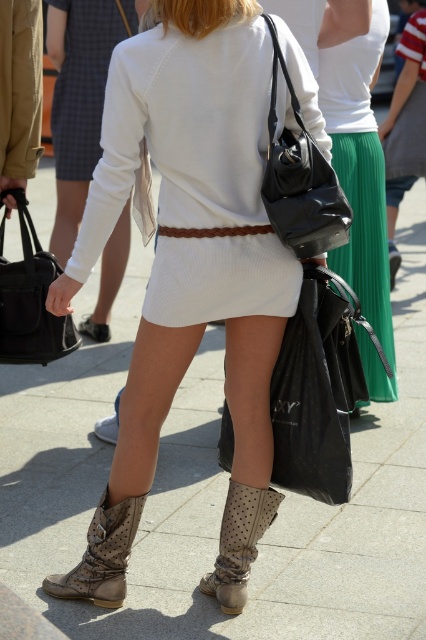
Question: Which point is farther from the camera taking this photo?

Choices:
 (A) (97, 524)
 (B) (229, 554)

Answer: (A)

Question: Among these points, which one is nearest to the camera?

Choices:
 (A) (226, 509)
 (B) (298, 252)
 (C) (351, 237)
 (D) (80, 330)

Answer: (B)

Question: Which point appears closest to the camera in this image?

Choices:
 (A) (118, 509)
 (B) (106, 339)
 (C) (337, 211)
 (D) (350, 154)

Answer: (C)

Question: Does black leather bag at upper right come behind leather sandal at lower center?

Choices:
 (A) yes
 (B) no

Answer: (B)

Question: Does green pleated skirt at upper center appear on the left side of white knit dress at center?

Choices:
 (A) yes
 (B) no

Answer: (B)

Question: Can you confirm if leather boots at lower center is bigger than leather sandal at lower center?

Choices:
 (A) no
 (B) yes

Answer: (B)